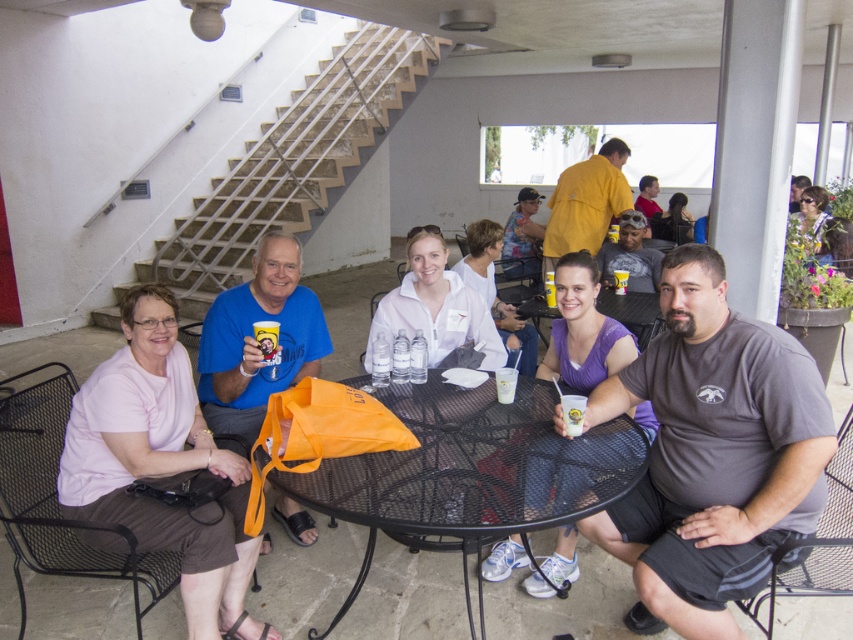
Does point (212, 612) lie behind point (647, 316)?

No.

Which of these two, pink fabric shirt at left or metallic black table at center, stands shorter?

Standing shorter between the two is metallic black table at center.

Identify the location of pink fabric shirt at left. (160, 465).

Who is shorter, black mesh table at center or orange fabric bag at center?

With less height is black mesh table at center.

Which is below, black mesh table at center or orange fabric bag at center?

black mesh table at center

Is point (440, 396) in front of point (293, 339)?

Yes, it is in front of point (293, 339).

Identify the location of black mesh table at center. coord(471,468).

Can you confirm if black mesh table at center is positioned above purple cotton shirt at center?

No.

Is black mesh table at center shorter than purple cotton shirt at center?

Correct, black mesh table at center is not as tall as purple cotton shirt at center.

Image resolution: width=853 pixels, height=640 pixels. I want to click on black mesh table at center, so click(x=471, y=468).